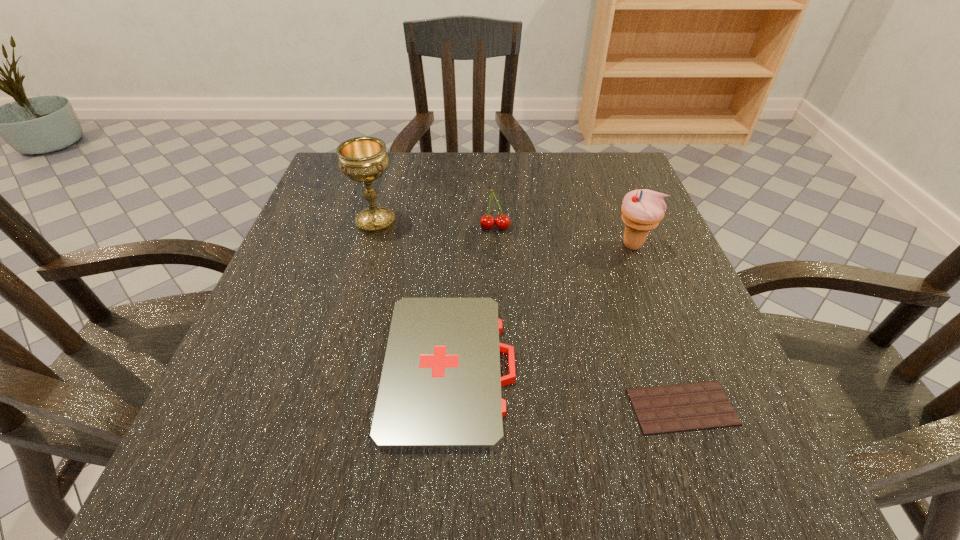
This screenshot has width=960, height=540. What are the coordinates of `empty space that is in between the icecream and the third tallest object` in the screenshot? It's located at (564, 237).

Identify the location of empty location between the shortest object and the chalice. The width and height of the screenshot is (960, 540). (529, 314).

This screenshot has height=540, width=960. Identify the location of vacant space that is in between the third tallest object and the second tallest object. (564, 237).

Choose which object is the fourth nearest neighbor to the icecream. Please provide its 2D coordinates. Your answer should be formatted as a tuple, i.e. [(x, y)], where the tuple contains the x and y coordinates of a point satisfying the conditions above.

[(362, 159)]

Where is `the third closest object to the shortest object`? The height and width of the screenshot is (540, 960). the third closest object to the shortest object is located at coordinates click(x=487, y=222).

Find the location of a particular element. This screenshot has width=960, height=540. vacant area that satisfies the following two spatial constraints: 1. on handle side the first-aid kit; 2. on the right side of the shortest object is located at coordinates (447, 407).

You are a GUI agent. You are given a task and a screenshot of the screen. Output one action in this format:
    pyautogui.click(x=<x>, y=<y>)
    Task: Click on the vacant space that satisfies the following two spatial constraints: 1. on handle side the shortest object; 2. on the right side of the fourth tallest object
    
    Given the screenshot: What is the action you would take?
    pyautogui.click(x=447, y=407)

You are a GUI agent. You are given a task and a screenshot of the screen. Output one action in this format:
    pyautogui.click(x=<x>, y=<y>)
    Task: Click on the free space that satisfies the following two spatial constraints: 1. with the stems of the cherry pointing upwards; 2. on handle side the fourth tallest object
    
    Given the screenshot: What is the action you would take?
    tap(501, 367)